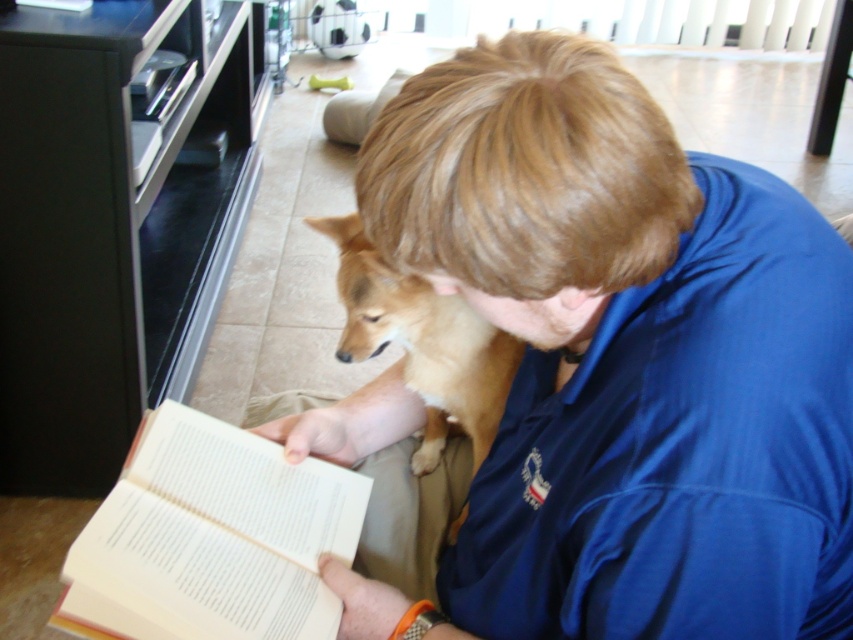
Question: Which object is farther from the camera taking this photo?

Choices:
 (A) blue fabric shirt at center
 (B) light brown fur at center

Answer: (B)

Question: Which point appears farthest from the camera in this image?

Choices:
 (A) (135, 492)
 (B) (547, 596)
 (C) (416, 296)

Answer: (C)

Question: Can you confirm if white paper book at lower left is bigger than light brown fur at center?

Choices:
 (A) no
 (B) yes

Answer: (A)

Question: Does blue fabric shirt at center come behind light brown fur at center?

Choices:
 (A) no
 (B) yes

Answer: (A)

Question: Which of the following is the closest to the observer?

Choices:
 (A) light brown fur at center
 (B) blue fabric shirt at center

Answer: (B)

Question: Does blue fabric shirt at center lie behind light brown fur at center?

Choices:
 (A) yes
 (B) no

Answer: (B)